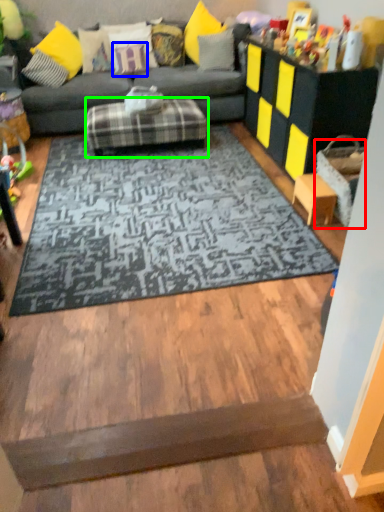
Question: Which object is positioned closest to table (highlighted by a red box)? Select from pillow (highlighted by a blue box) and footrest (highlighted by a green box).

Choices:
 (A) pillow
 (B) footrest

Answer: (B)